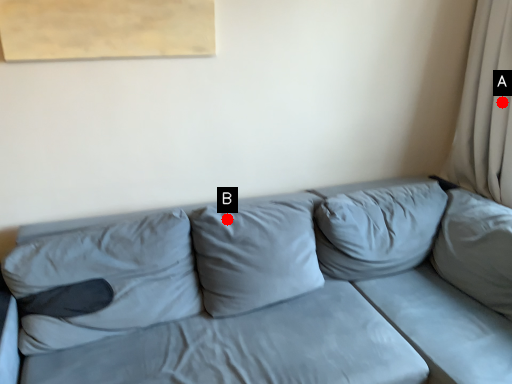
Question: Two points are circled on the image, labeled by A and B beside each circle. Which point appears closest to the camera in this image?

Choices:
 (A) A is closer
 (B) B is closer

Answer: (B)